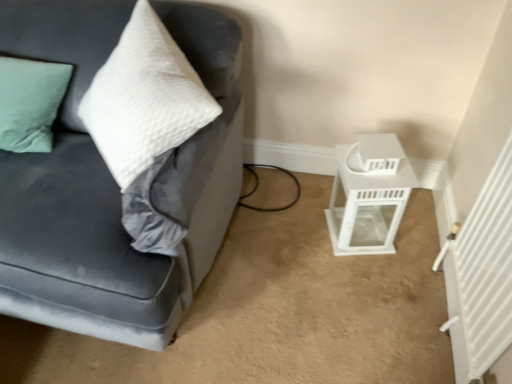
Locate an element on the screen. vacant area located to the right-hand side of white glossy lantern at lower right is located at coordinates (413, 231).